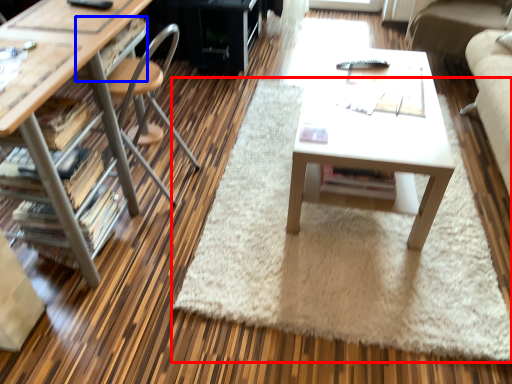
Question: Which point is closer to the camera, mat (highlighted by a red box) or drawer (highlighted by a blue box)?

Choices:
 (A) mat
 (B) drawer

Answer: (A)